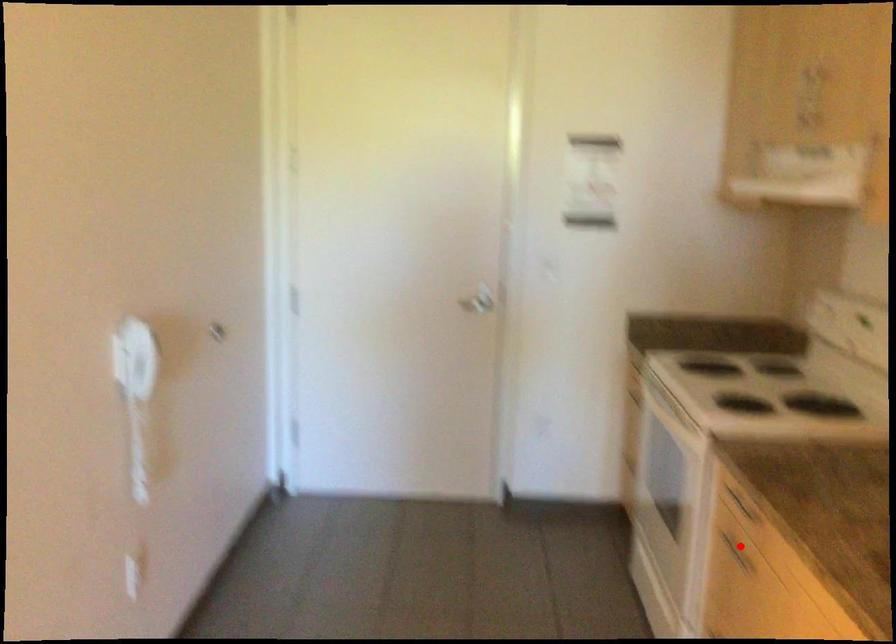
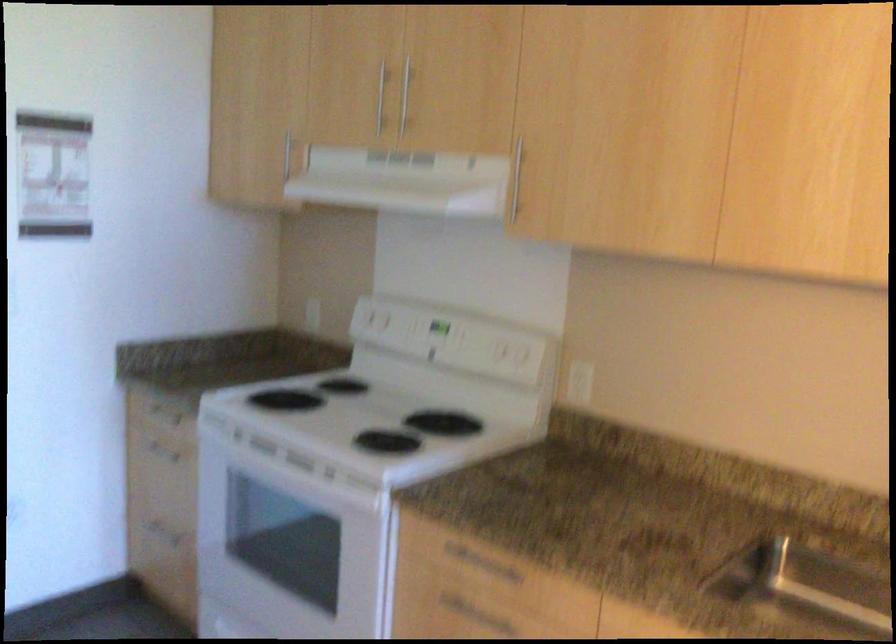
Locate, in the second image, the point that corresponds to the highlighted location in the first image.

(466, 609)